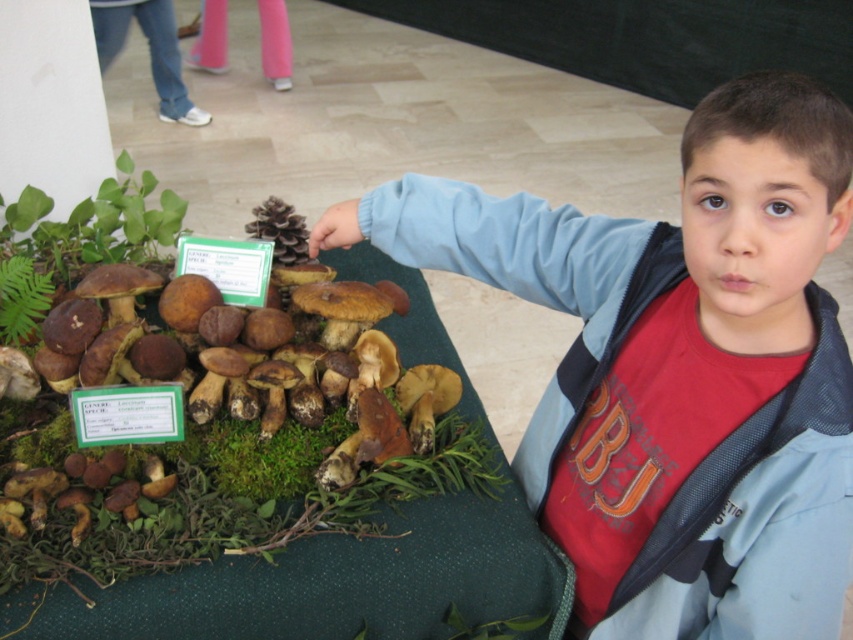
Question: Is matte brown mushroom at upper left closer to the viewer compared to green leafy plant at upper left?

Choices:
 (A) yes
 (B) no

Answer: (A)

Question: Which object is farther from the camera taking this photo?

Choices:
 (A) green moss at lower left
 (B) green leafy fern at lower left
 (C) green moss at center

Answer: (B)

Question: Where is green leafy fern at lower left located in relation to green moss at lower left in the image?

Choices:
 (A) right
 (B) left

Answer: (B)

Question: Which object is farther from the camera taking this photo?

Choices:
 (A) green leafy fern at lower left
 (B) matte brown mushroom at upper left

Answer: (A)

Question: Based on their relative distances, which object is nearer to the matte brown mushroom at upper left?

Choices:
 (A) green leafy plant at upper left
 (B) green moss at lower left
 (C) green moss at center
 (D) green leafy fern at lower left

Answer: (B)

Question: Is green moss at center wider than green leafy fern at lower left?

Choices:
 (A) yes
 (B) no

Answer: (A)